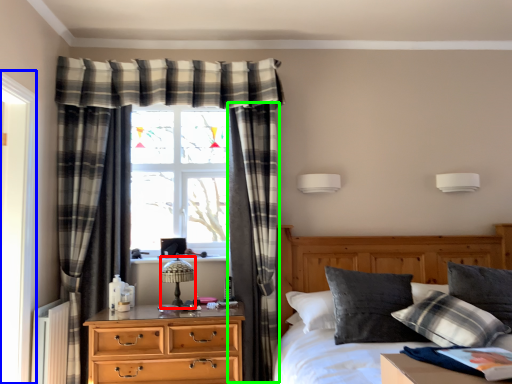
Question: Estimate the real-world distances between objects in this image. Which object is closer to table lamp (highlighted by a red box), screen door (highlighted by a blue box) or curtain (highlighted by a green box)?

Choices:
 (A) screen door
 (B) curtain

Answer: (B)